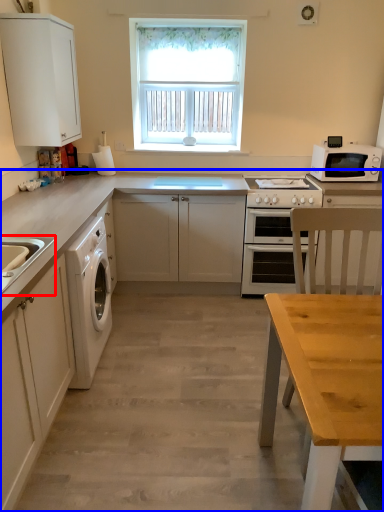
Question: Which of the following is the farthest to the observer, sink (highlighted by a red box) or countertop (highlighted by a blue box)?

Choices:
 (A) sink
 (B) countertop

Answer: (B)